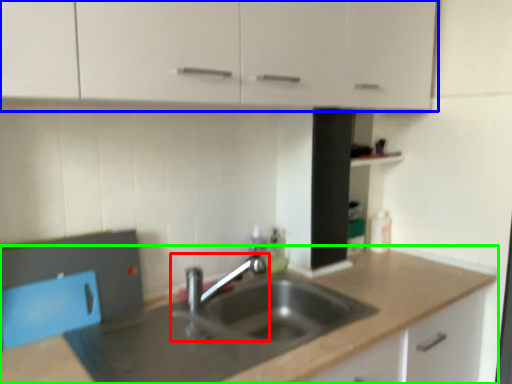
Question: Which object is the closest to the tap (highlighted by a red box)? Choose among these: cabinetry (highlighted by a blue box) or countertop (highlighted by a green box).

Choices:
 (A) cabinetry
 (B) countertop

Answer: (B)